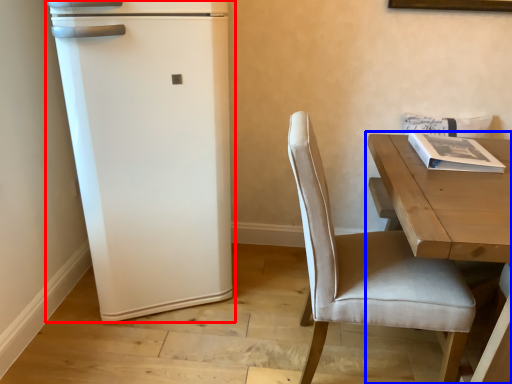
Question: Which object appears closest to the camera in this image, refrigerator (highlighted by a red box) or table (highlighted by a blue box)?

Choices:
 (A) refrigerator
 (B) table

Answer: (B)